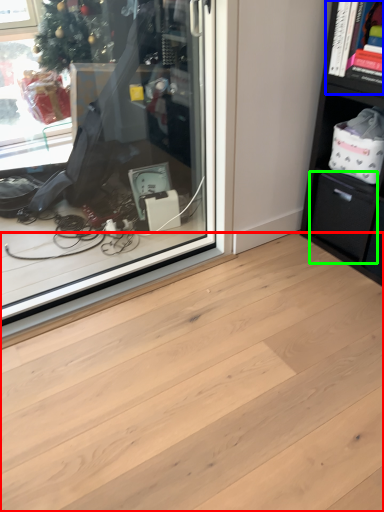
Question: Which object is the farthest from plank (highlighted by a red box)? Choose among these: cabinet (highlighted by a blue box) or drawer (highlighted by a green box).

Choices:
 (A) cabinet
 (B) drawer

Answer: (A)